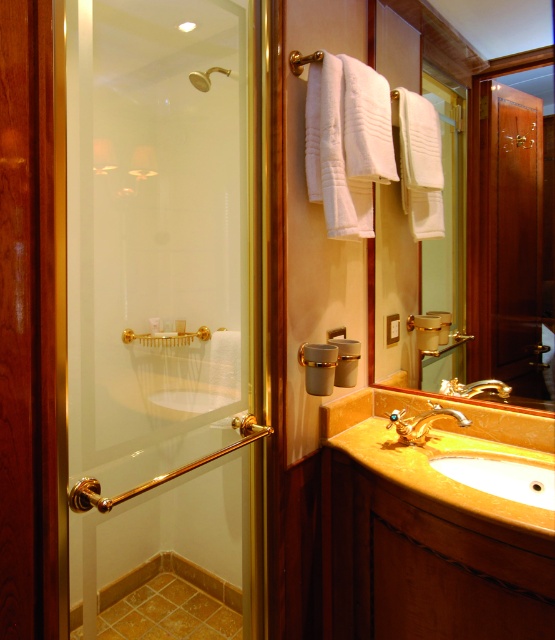
Between gold metallic faucet at sink right and matte gold showerhead at upper left, which one has more height?

Standing taller between the two is matte gold showerhead at upper left.

Does point (506, 385) come closer to viewer compared to point (209, 83)?

Yes, point (506, 385) is in front of point (209, 83).

Who is more distant from viewer, (506, 394) or (204, 81)?

The point (204, 81) is more distant.

Where is `gold metallic faucet at sink right`? This screenshot has width=555, height=640. gold metallic faucet at sink right is located at coordinates (486, 387).

Is clear glass shower door at left above yellow marble sink at lower center?

Indeed, clear glass shower door at left is positioned over yellow marble sink at lower center.

Can you confirm if clear glass shower door at left is shorter than yellow marble sink at lower center?

No.

Where is `clear glass shower door at left`? clear glass shower door at left is located at coordinates (158, 317).

Is matte gold mirror at center to the right of matte gold showerhead at upper left from the viewer's perspective?

Correct, you'll find matte gold mirror at center to the right of matte gold showerhead at upper left.

Which of these two, matte gold mirror at center or matte gold showerhead at upper left, stands shorter?

matte gold showerhead at upper left

Locate an element on the screen. matte gold mirror at center is located at coordinates (472, 166).